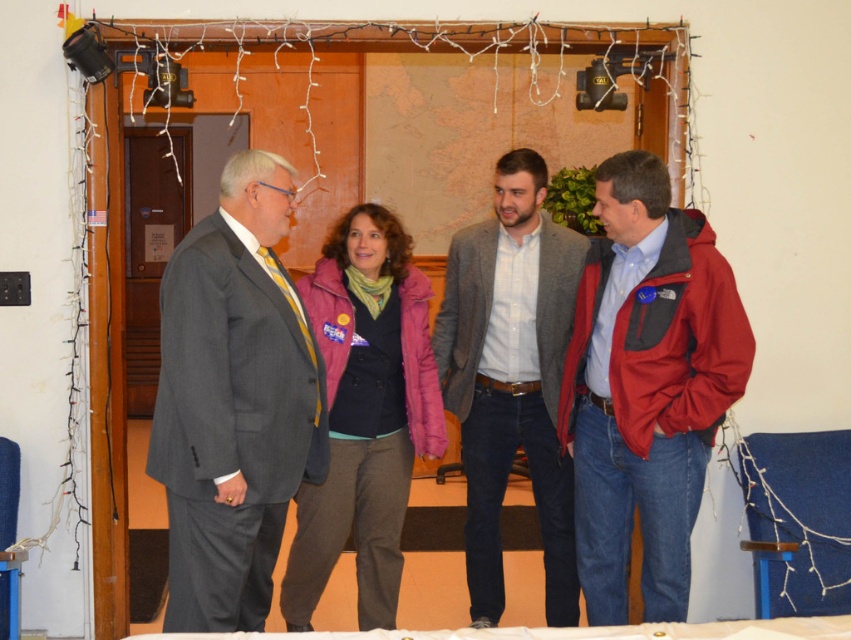
Question: Is red softshell jacket at right smaller than matte gray suit at left?

Choices:
 (A) yes
 (B) no

Answer: (B)

Question: Which point is closer to the camera taking this photo?

Choices:
 (A) (387, 289)
 (B) (241, 624)
 (C) (649, 508)

Answer: (C)

Question: Which of these objects is positioned closest to the gray woolen blazer at center?

Choices:
 (A) red softshell jacket at right
 (B) pink fleece jacket at center
 (C) matte gray suit at left

Answer: (B)

Question: Which point is farther from the camera taking this photo?

Choices:
 (A) (475, 316)
 (B) (678, 376)
 (C) (392, 316)

Answer: (A)

Question: Where is red softshell jacket at right located in relation to pink fleece jacket at center in the image?

Choices:
 (A) below
 (B) above

Answer: (B)

Question: Does matte gray suit at left have a greater width compared to gray woolen blazer at center?

Choices:
 (A) yes
 (B) no

Answer: (B)